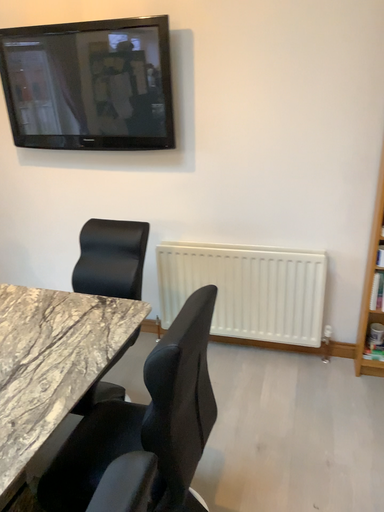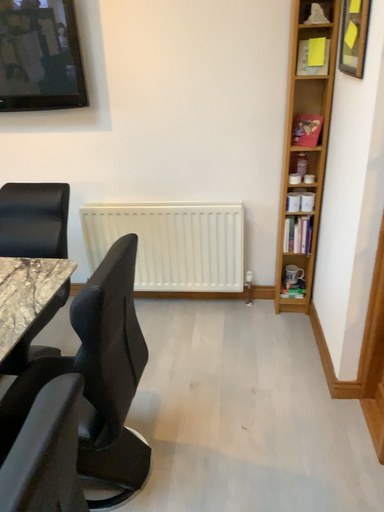
Question: Which way did the camera rotate in the video?

Choices:
 (A) rotated left
 (B) rotated right

Answer: (B)